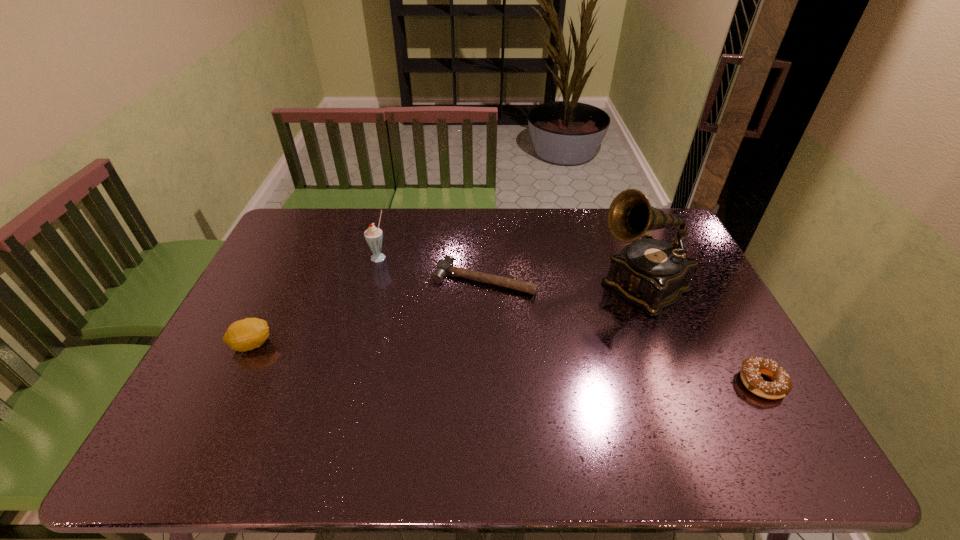
Find the location of a particular element. This screenshot has height=540, width=960. empty location between the phonograph record and the shortest object is located at coordinates (563, 283).

Identify the location of free space between the doughnut and the tallest object. (702, 334).

The image size is (960, 540). In order to click on unoccupied area between the milkshake and the phonograph record in this screenshot , I will do `click(510, 271)`.

Image resolution: width=960 pixels, height=540 pixels. I want to click on free space between the tallest object and the third object from left to right, so click(563, 283).

At what (x,y) coordinates should I click in order to perform the action: click on free space between the phonograph record and the second nearest object. Please return your answer as a coordinate pair (x, y). Looking at the image, I should click on (446, 315).

I want to click on vacant space that's between the lemon and the tallest object, so click(x=446, y=315).

Identify the location of vacant space in between the nearest object and the lemon. (507, 363).

I want to click on free point between the tallest object and the hammer, so click(x=563, y=283).

Identify the location of the second closest object relative to the fourth object from right to left. (247, 334).

Identify the location of object that is the third closest to the fourth tallest object. (373, 235).